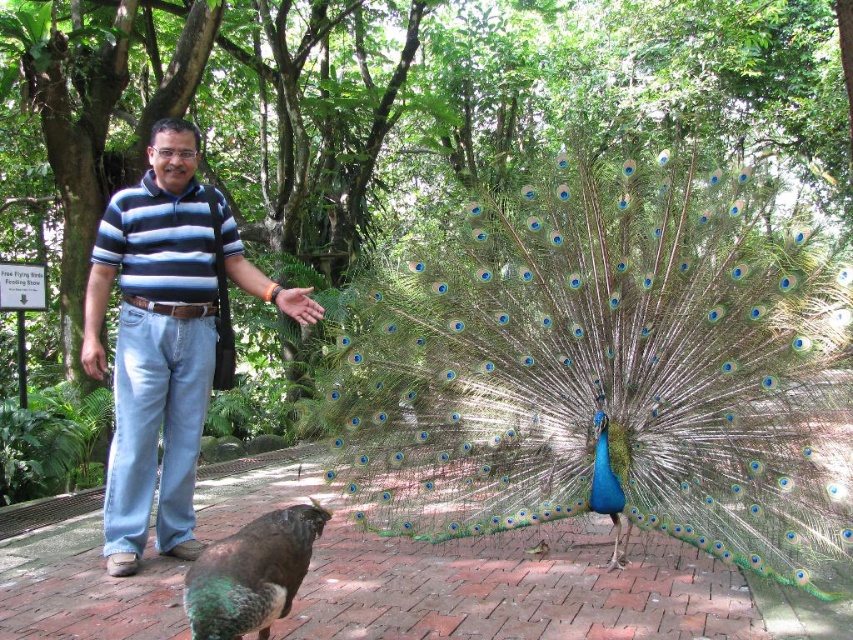
You are a fashion designer observing the scene and notice two blue striped shirts. Which one is taller, the blue striped shirt at center or the blue striped polo shirt at center?

The blue striped shirt at center is taller than the blue striped polo shirt at center.

You are a photographer trying to capture the peacock and the man in the striped polo shirt. You notice a specific point in the image at coordinates (154, 346). Based on the scene, what object or part of the scene does this point correspond to?

The point at coordinates (154, 346) is on the blue striped shirt at center.